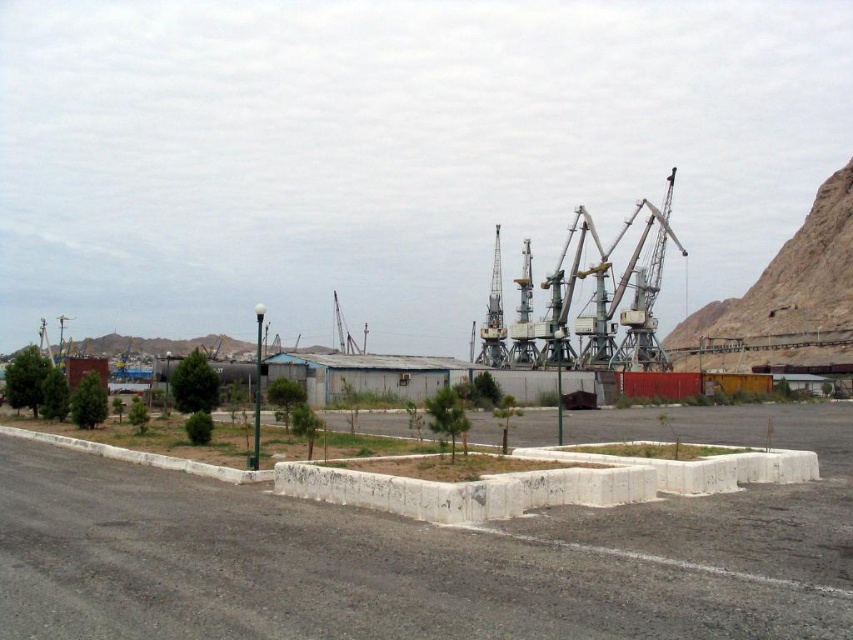
This screenshot has height=640, width=853. Describe the element at coordinates (422, 556) in the screenshot. I see `concrete at center` at that location.

This screenshot has width=853, height=640. What are the coordinates of `concrete at center` in the screenshot? It's located at (x=422, y=556).

Locate an element on the screen. concrete at center is located at coordinates (422, 556).